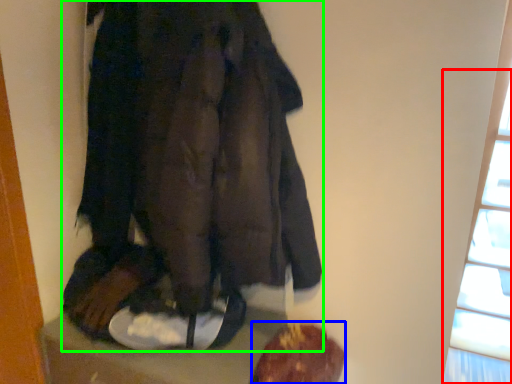
Question: Which object is the farthest from window (highlighted by a red box)? Choose among these: food (highlighted by a blue box) or fancy dress (highlighted by a green box).

Choices:
 (A) food
 (B) fancy dress

Answer: (B)